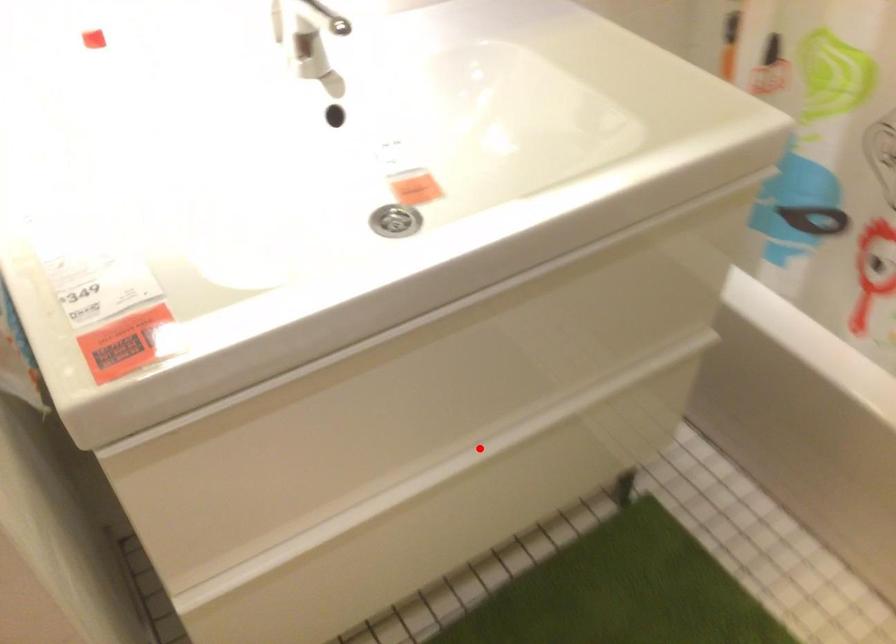
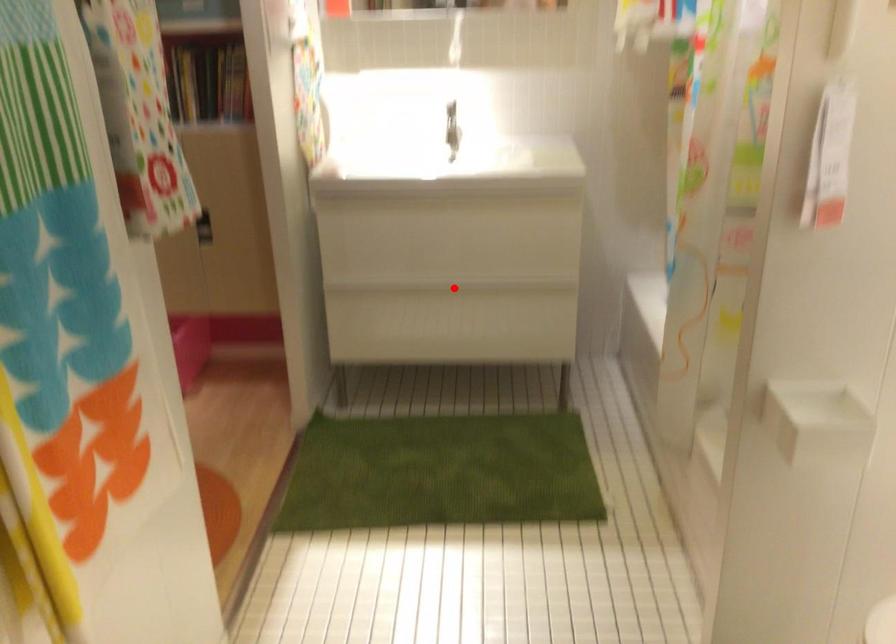
I am providing you with two images of the same scene from different viewpoints. A red point is marked on the first image and another point is marked on the second image. Do the highlighted points in image1 and image2 indicate the same real-world spot?

Yes